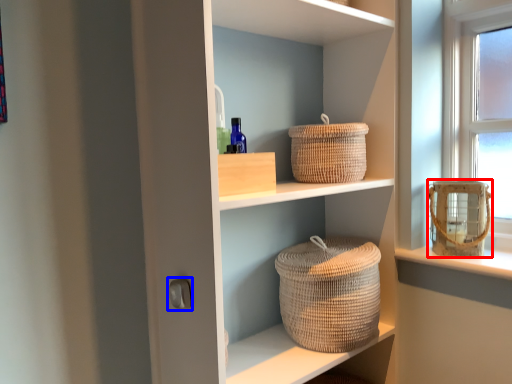
Question: Which object is closer to the camera taking this photo, basket container (highlighted by a red box) or door handle (highlighted by a blue box)?

Choices:
 (A) basket container
 (B) door handle

Answer: (B)